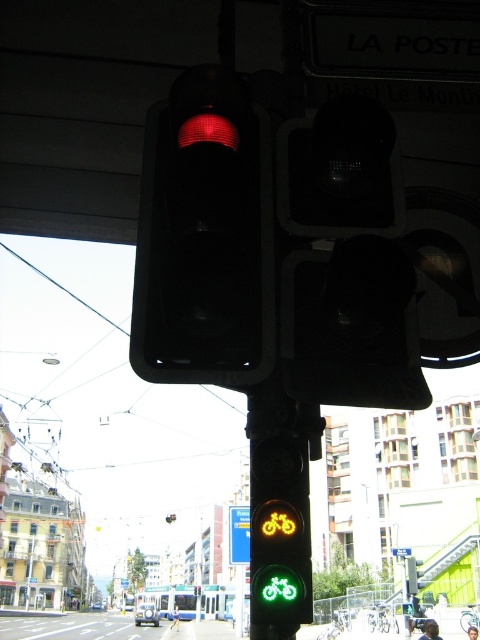
Question: Considering the relative positions of matte black traffic light at upper center and blue plastic street sign at upper center in the image provided, where is matte black traffic light at upper center located with respect to blue plastic street sign at upper center?

Choices:
 (A) above
 (B) below

Answer: (A)

Question: Is matte black traffic light at upper center further to the viewer compared to green glass bicycle at center?

Choices:
 (A) yes
 (B) no

Answer: (B)

Question: Considering the real-world distances, which object is farthest from the blue plastic road sign at upper center?

Choices:
 (A) blue plastic street sign at upper center
 (B) blue plastic bicycle at lower center
 (C) matte black traffic light at upper center
 (D) green glass bicycle at center

Answer: (C)

Question: Is matte black traffic light at upper center closer to the viewer compared to blue plastic bicycle at lower center?

Choices:
 (A) no
 (B) yes

Answer: (B)

Question: Which of these objects is positioned closest to the blue plastic road sign at upper center?

Choices:
 (A) blue plastic street sign at upper center
 (B) matte red traffic light at upper center

Answer: (A)

Question: Which point is farther to the camera?

Choices:
 (A) (126, 580)
 (B) (171, 515)

Answer: (A)